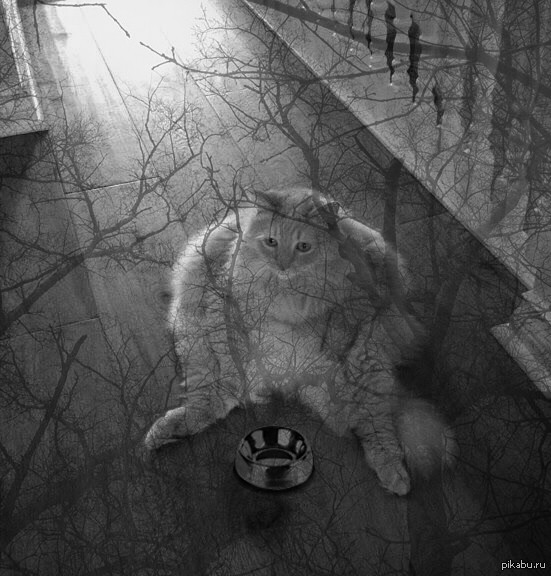
This screenshot has width=551, height=576. In order to click on wooden floor in this screenshot , I will do `click(93, 287)`, `click(226, 102)`.